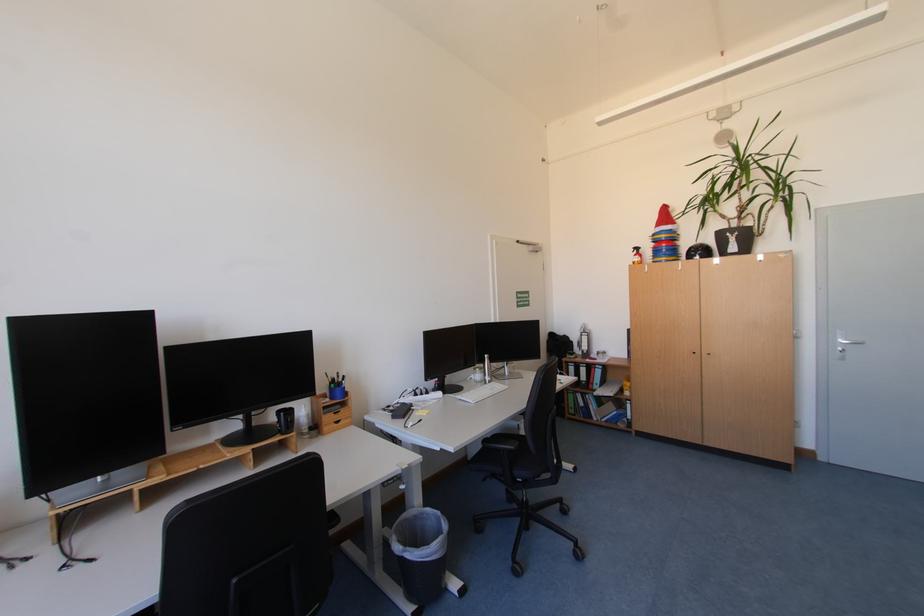
In order to click on small drawer handle in this screenshot , I will do `click(329, 427)`.